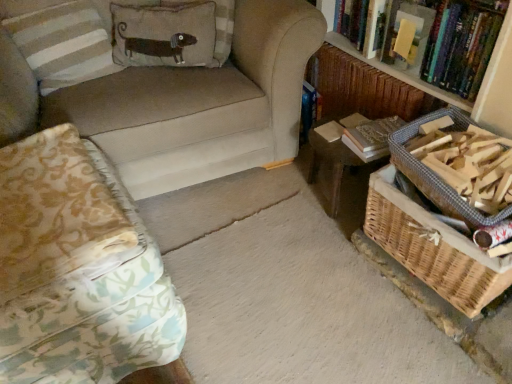
Question: From a real-world perspective, is striped fabric pillow at upper left, which appears as the first pillow when viewed from the left, physically above patterned fabric studio couch at left, which appears as the second studio couch when viewed from the top?

Choices:
 (A) yes
 (B) no

Answer: (A)

Question: Considering the relative sizes of striped fabric pillow at upper left, placed as the 3th pillow when sorted from right to left, and patterned fabric studio couch at left, placed as the 1th studio couch when sorted from bottom to top, in the image provided, is striped fabric pillow at upper left, placed as the 3th pillow when sorted from right to left, smaller than patterned fabric studio couch at left, placed as the 1th studio couch when sorted from bottom to top,?

Choices:
 (A) no
 (B) yes

Answer: (B)

Question: From the image's perspective, is striped fabric pillow at upper left, which appears as the first pillow when viewed from the left, under patterned fabric studio couch at left, placed as the 1th studio couch when sorted from bottom to top?

Choices:
 (A) no
 (B) yes

Answer: (A)

Question: Considering the relative positions of striped fabric pillow at upper left, placed as the 3th pillow when sorted from right to left, and patterned fabric studio couch at left, placed as the 1th studio couch when sorted from bottom to top, in the image provided, is striped fabric pillow at upper left, placed as the 3th pillow when sorted from right to left, to the left of patterned fabric studio couch at left, placed as the 1th studio couch when sorted from bottom to top, from the viewer's perspective?

Choices:
 (A) no
 (B) yes

Answer: (B)

Question: Is striped fabric pillow at upper left, placed as the 3th pillow when sorted from right to left, further to camera compared to patterned fabric studio couch at left, placed as the 1th studio couch when sorted from bottom to top?

Choices:
 (A) yes
 (B) no

Answer: (A)

Question: Would you say textured beige pillow with dog design at upper left, arranged as the second pillow when viewed from the left, is inside or outside striped fabric pillow at upper left, placed as the 3th pillow when sorted from right to left?

Choices:
 (A) outside
 (B) inside

Answer: (A)

Question: From the image's perspective, relative to striped fabric pillow at upper left, placed as the 3th pillow when sorted from right to left, is textured beige pillow with dog design at upper left, the second pillow in the right-to-left sequence, above or below?

Choices:
 (A) above
 (B) below

Answer: (A)

Question: Considering their positions, is textured beige pillow with dog design at upper left, the second pillow in the right-to-left sequence, located in front of or behind striped fabric pillow at upper left, placed as the 3th pillow when sorted from right to left?

Choices:
 (A) behind
 (B) front

Answer: (A)

Question: Is point (172, 61) closer or farther from the camera than point (96, 76)?

Choices:
 (A) closer
 (B) farther

Answer: (A)

Question: Is point (440, 253) positioned closer to the camera than point (31, 34)?

Choices:
 (A) farther
 (B) closer

Answer: (B)

Question: In terms of height, does woven brown basket at lower right, the first basket positioned from the bottom, look taller or shorter compared to suede-like beige couch at upper left, positioned as the 2th studio couch in bottom-to-top order?

Choices:
 (A) tall
 (B) short

Answer: (B)

Question: In the image, is woven brown basket at lower right, the first basket positioned from the bottom, on the left side or the right side of suede-like beige couch at upper left, the 1th studio couch viewed from the top?

Choices:
 (A) right
 (B) left

Answer: (A)

Question: From the image's perspective, is woven brown basket at lower right, the second basket when ordered from top to bottom, above or below suede-like beige couch at upper left, positioned as the 2th studio couch in bottom-to-top order?

Choices:
 (A) below
 (B) above

Answer: (A)

Question: Looking at their shapes, would you say striped fabric pillow at upper left, placed as the 3th pillow when sorted from right to left, is wider or thinner than patterned fabric studio couch at left, which appears as the second studio couch when viewed from the top?

Choices:
 (A) thin
 (B) wide

Answer: (A)

Question: Is point (89, 51) positioned closer to the camera than point (16, 332)?

Choices:
 (A) closer
 (B) farther

Answer: (B)